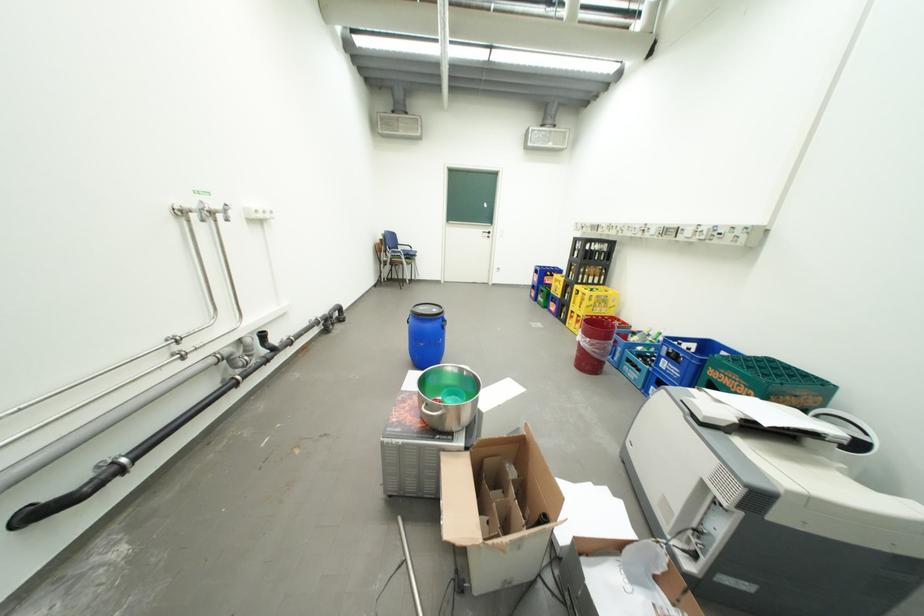
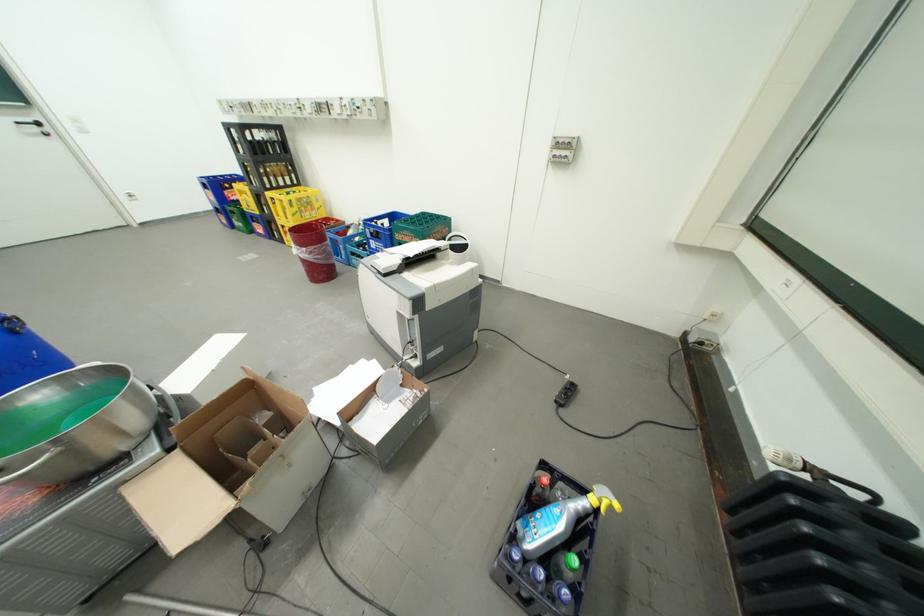
In the second image, find the point that corresponds to point 599,341 in the first image.

(314, 249)